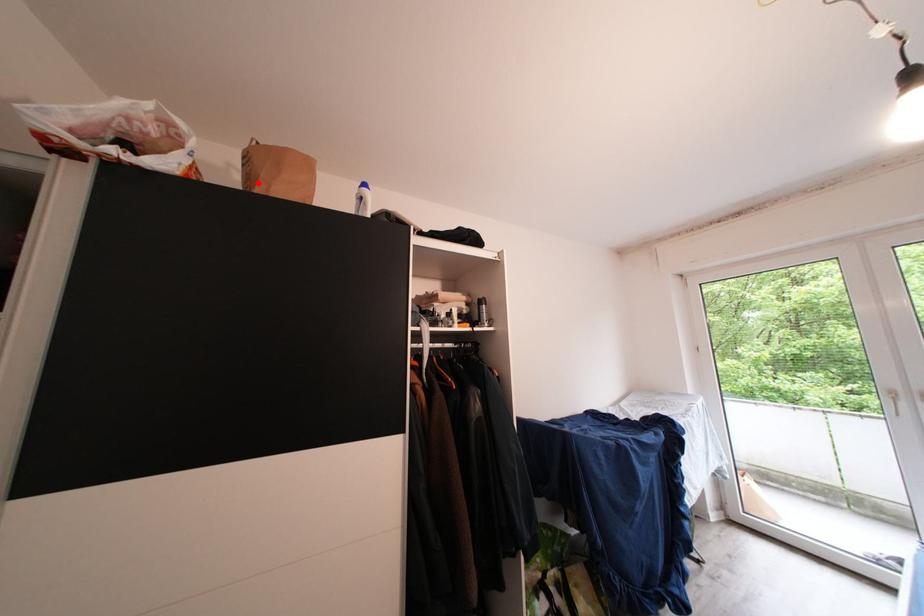
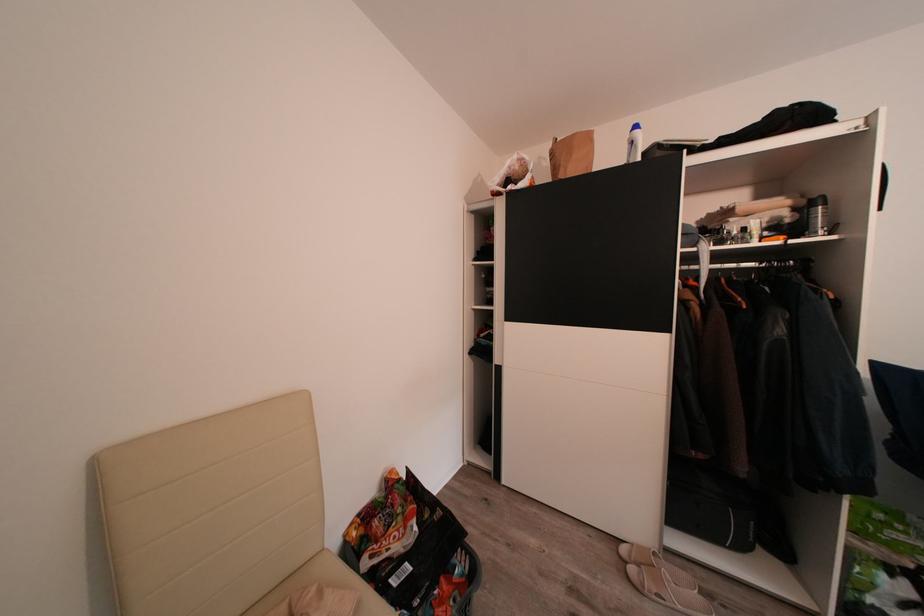
Find the pixel in the second image that matches the highlighted location in the first image.

(564, 174)